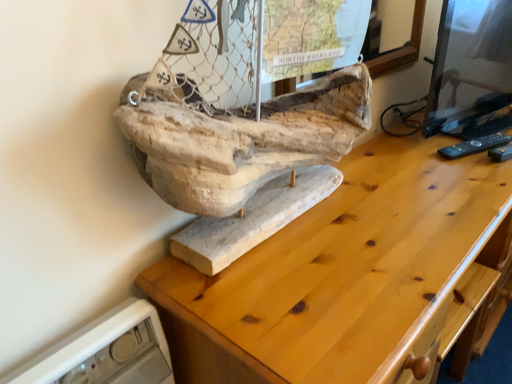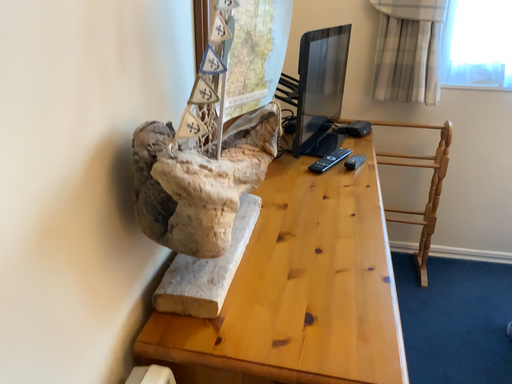
Question: Which way did the camera rotate in the video?

Choices:
 (A) rotated downward
 (B) rotated upward

Answer: (B)